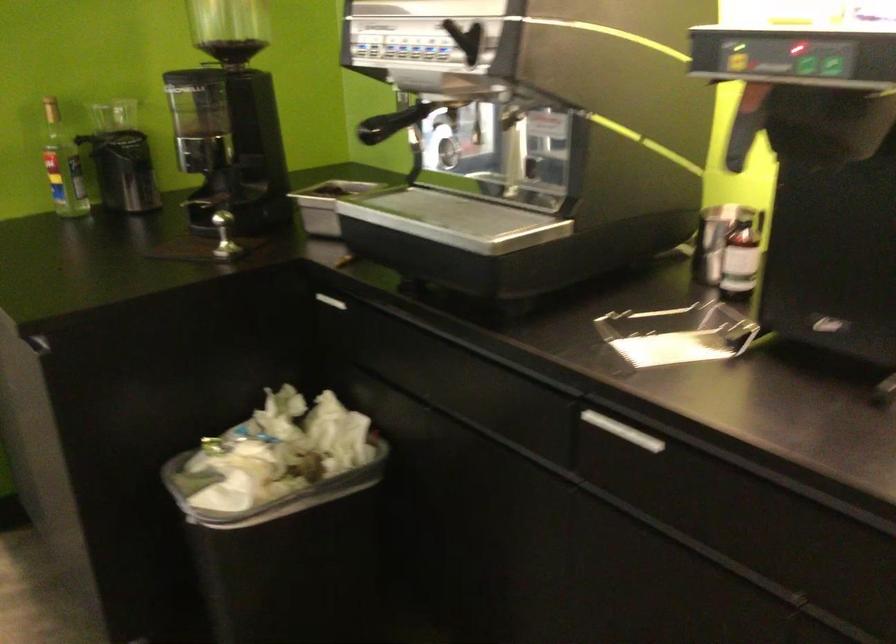
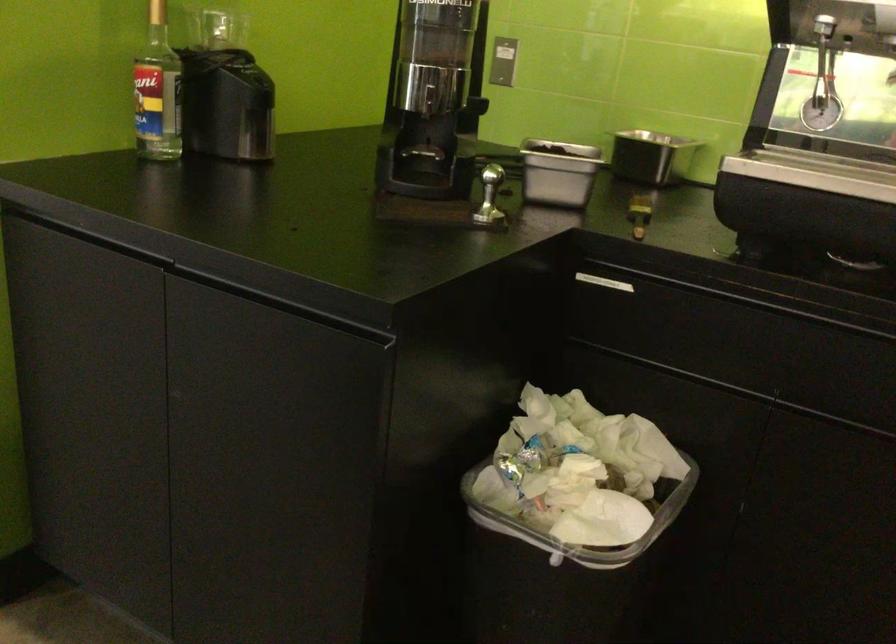
The point at (x=389, y=306) is marked in the first image. Where is the corresponding point in the second image?

(744, 287)